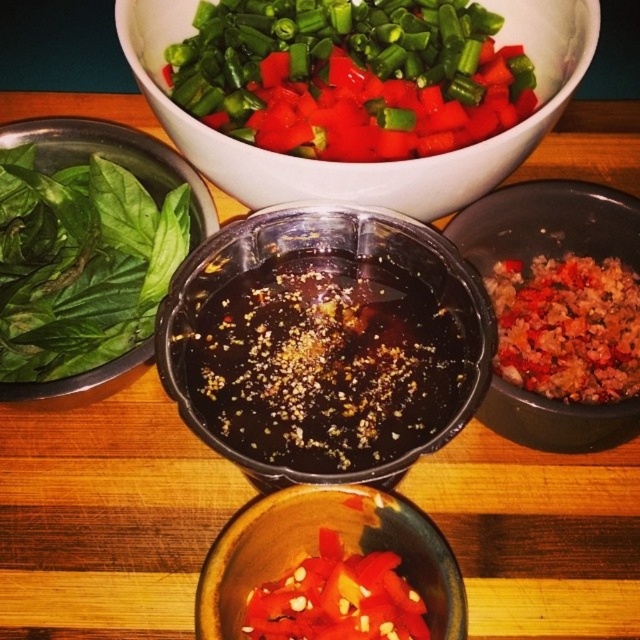
Does black plastic bowl at center come behind matte ceramic bowl at lower center?

Yes, black plastic bowl at center is further from the viewer.

Between black plastic bowl at center and matte ceramic bowl at lower center, which one has more height?

black plastic bowl at center is taller.

Where is `black plastic bowl at center`? black plastic bowl at center is located at coordinates (324, 344).

Between point (136, 29) and point (525, 435), which one is positioned in front?

Point (525, 435) is more forward.

Is white ceramic bowl at upper center wider than brown crumbly mixture at right?

Yes.

This screenshot has height=640, width=640. Identify the location of white ceramic bowl at upper center. (369, 163).

Does black plastic bowl at center appear over white ceramic bowl at upper center?

Actually, black plastic bowl at center is below white ceramic bowl at upper center.

Between point (390, 433) and point (424, 186), which one is positioned behind?

The point (424, 186) is more distant.

This screenshot has height=640, width=640. Find the location of `black plastic bowl at center`. black plastic bowl at center is located at coordinates (324, 344).